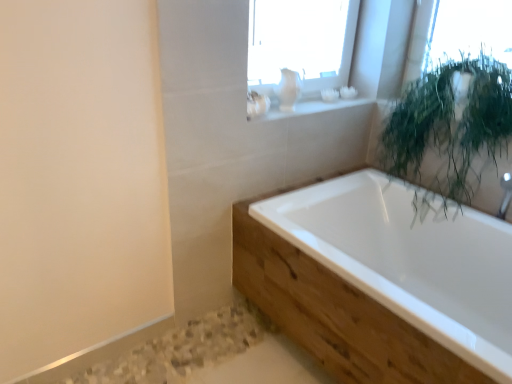
Question: Is white ceramic vase at upper center aimed at white glossy bathtub at center?

Choices:
 (A) yes
 (B) no

Answer: (B)

Question: Considering the relative positions of white ceramic vase at upper center and white glossy bathtub at center in the image provided, is white ceramic vase at upper center to the left of white glossy bathtub at center from the viewer's perspective?

Choices:
 (A) no
 (B) yes

Answer: (B)

Question: Is white ceramic vase at upper center taller than white glossy bathtub at center?

Choices:
 (A) no
 (B) yes

Answer: (A)

Question: Can you confirm if white ceramic vase at upper center is wider than white glossy bathtub at center?

Choices:
 (A) yes
 (B) no

Answer: (B)

Question: Does white ceramic vase at upper center have a larger size compared to white glossy bathtub at center?

Choices:
 (A) no
 (B) yes

Answer: (A)

Question: Relative to white glossy bathtub at center, is green leafy plant at upper right in front or behind?

Choices:
 (A) behind
 (B) front

Answer: (A)

Question: From a real-world perspective, relative to white glossy bathtub at center, is green leafy plant at upper right vertically above or below?

Choices:
 (A) above
 (B) below

Answer: (A)

Question: Do you think green leafy plant at upper right is within white glossy bathtub at center, or outside of it?

Choices:
 (A) outside
 (B) inside

Answer: (A)

Question: Considering the positions of green leafy plant at upper right and white glossy bathtub at center in the image, is green leafy plant at upper right bigger or smaller than white glossy bathtub at center?

Choices:
 (A) big
 (B) small

Answer: (B)

Question: Is white glossy bathtub at center in front of or behind white ceramic vase at upper center in the image?

Choices:
 (A) behind
 (B) front

Answer: (B)

Question: Is white glossy bathtub at center spatially inside white ceramic vase at upper center, or outside of it?

Choices:
 (A) inside
 (B) outside

Answer: (B)

Question: From the image's perspective, is white glossy bathtub at center positioned above or below white ceramic vase at upper center?

Choices:
 (A) below
 (B) above

Answer: (A)

Question: Is point (433, 240) closer or farther from the camera than point (259, 102)?

Choices:
 (A) closer
 (B) farther

Answer: (B)

Question: From the image's perspective, relative to white ceramic vase at upper center, is green leafy plant at upper right above or below?

Choices:
 (A) above
 (B) below

Answer: (B)

Question: Based on their positions, is green leafy plant at upper right located to the left or right of white ceramic vase at upper center?

Choices:
 (A) right
 (B) left

Answer: (A)